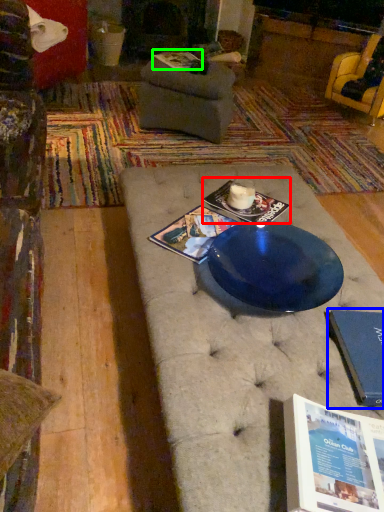
Question: Which object is positioned closest to magazine (highlighted by a red box)? Select from paperback book (highlighted by a blue box) and magazine (highlighted by a green box).

Choices:
 (A) paperback book
 (B) magazine

Answer: (A)